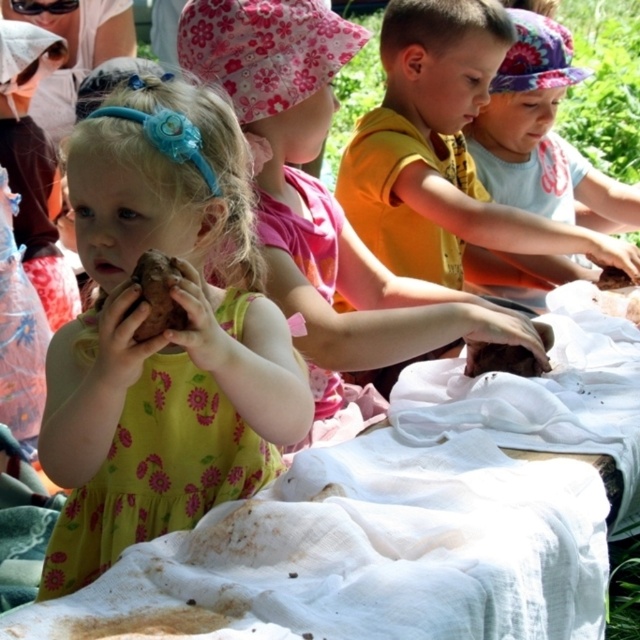
Does white cloth at center appear over yellow floral dress at center?

No.

Between point (516, 627) and point (177, 92), which one is positioned behind?

Point (177, 92)

This screenshot has width=640, height=640. Identify the location of white cloth at center. (408, 516).

The height and width of the screenshot is (640, 640). Identify the location of white cloth at center. (408, 516).

Locate an element on the screen. The image size is (640, 640). yellow floral dress at center is located at coordinates (163, 337).

Does point (234, 365) come behind point (476, 369)?

That is False.

Which is behind, point (218, 340) or point (531, 362)?

The point (531, 362) is more distant.

Which is behind, point (113, 212) or point (506, 355)?

The point (506, 355) is more distant.

The width and height of the screenshot is (640, 640). I want to click on yellow floral dress at center, so click(163, 337).